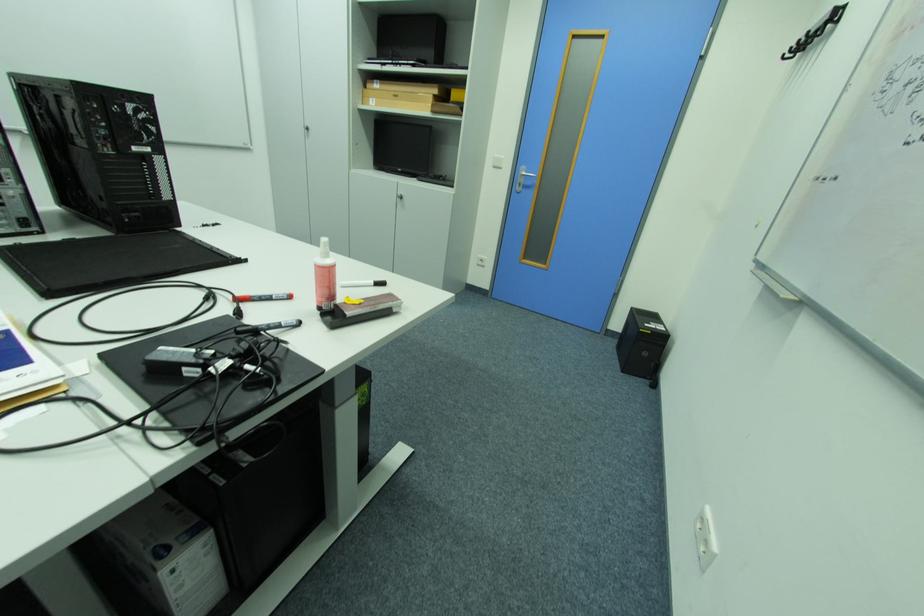
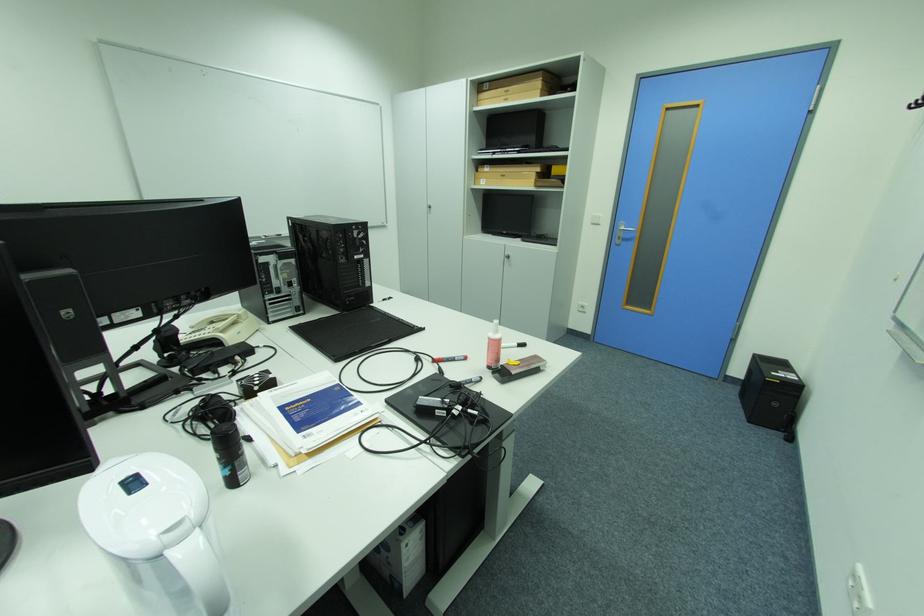
Find the pixel in the second image that matches pixel 504 156 in the first image.

(602, 215)